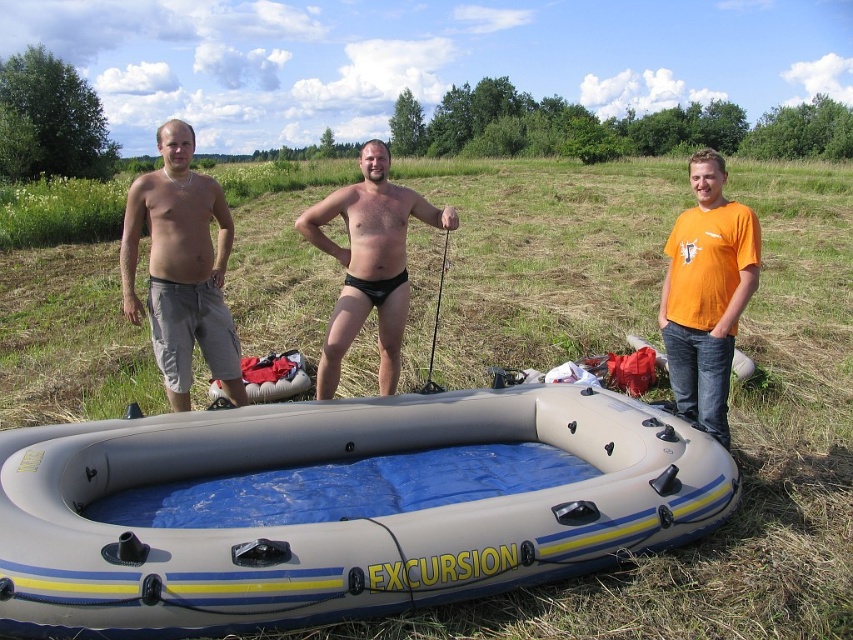
This screenshot has height=640, width=853. Describe the element at coordinates (706, 292) in the screenshot. I see `orange cotton t-shirt at right` at that location.

Is orange cotton t-shirt at right taller than black rubber fishing pole at center?

No.

Which is behind, point (723, 429) or point (434, 308)?

Point (434, 308)

The height and width of the screenshot is (640, 853). Identify the location of orange cotton t-shirt at right. (706, 292).

Is gray rubber boat at center shorter than matte gray shorts at left?

Yes, gray rubber boat at center is shorter than matte gray shorts at left.

Is gray rubber boat at center to the left of matte gray shorts at left from the viewer's perspective?

In fact, gray rubber boat at center is to the right of matte gray shorts at left.

The width and height of the screenshot is (853, 640). Describe the element at coordinates (337, 506) in the screenshot. I see `gray rubber boat at center` at that location.

The width and height of the screenshot is (853, 640). In order to click on gray rubber boat at center in this screenshot , I will do `click(337, 506)`.

Does orange cotton t-shirt at right have a smaller size compared to black matte swim trunks at center?

Actually, orange cotton t-shirt at right might be larger than black matte swim trunks at center.

Who is shorter, orange cotton t-shirt at right or black matte swim trunks at center?

Standing shorter between the two is orange cotton t-shirt at right.

Between point (712, 257) and point (419, 212), which one is positioned in front?

Positioned in front is point (712, 257).

This screenshot has height=640, width=853. What are the coordinates of `orange cotton t-shirt at right` in the screenshot? It's located at (706, 292).